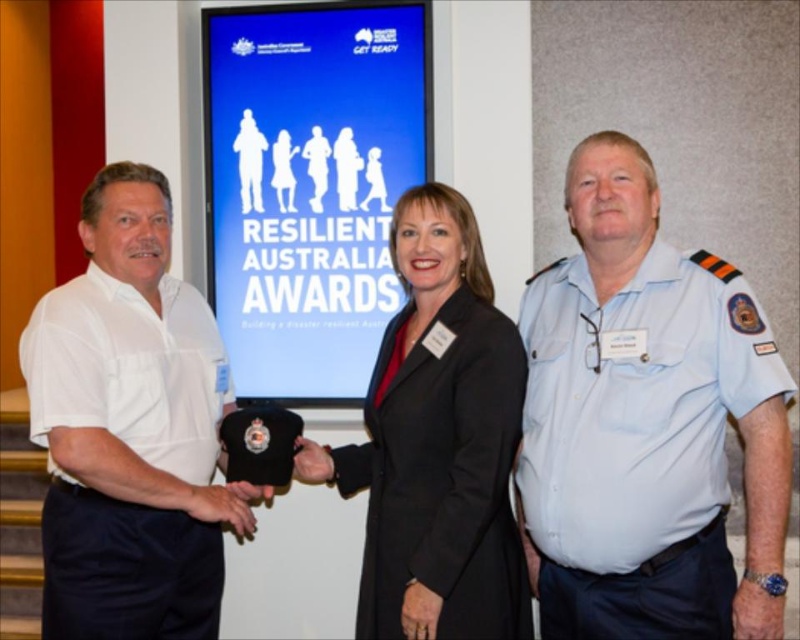
Which is more to the left, light blue uniform at center or black fabric coat at center?

black fabric coat at center

Is light blue uniform at center wider than black fabric coat at center?

Incorrect, light blue uniform at center's width does not surpass black fabric coat at center's.

Which is in front, point (640, 566) or point (448, 227)?

Point (640, 566)

Identify the location of light blue uniform at center. Image resolution: width=800 pixels, height=640 pixels. (646, 424).

Can you confirm if white cotton shirt at left is shorter than black fabric coat at center?

No.

From the picture: Which of these two, white cotton shirt at left or black fabric coat at center, stands shorter?

black fabric coat at center

Who is more forward, (130, 166) or (384, 404)?

Point (384, 404)

Locate an element on the screen. This screenshot has height=640, width=800. white cotton shirt at left is located at coordinates (130, 429).

Does light blue uniform at center have a lesser width compared to blue paper at center?

Yes, light blue uniform at center is thinner than blue paper at center.

Is light blue uniform at center bigger than blue paper at center?

Correct, light blue uniform at center is larger in size than blue paper at center.

The height and width of the screenshot is (640, 800). Describe the element at coordinates (646, 424) in the screenshot. I see `light blue uniform at center` at that location.

Where is `light blue uniform at center`? light blue uniform at center is located at coordinates (646, 424).